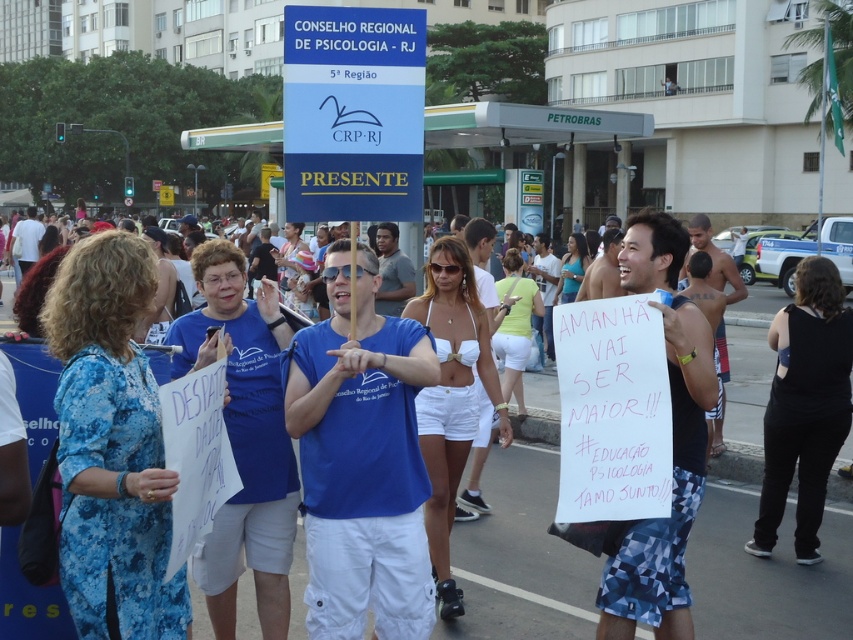
Question: Is white paper sign at center below blue plastic sign at upper center?

Choices:
 (A) yes
 (B) no

Answer: (A)

Question: Based on their relative distances, which object is nearer to the blue plastic sign at upper center?

Choices:
 (A) white paper sign at center
 (B) blue cotton shirt at center

Answer: (B)

Question: Which point appears closest to the camera in this image?

Choices:
 (A) (737, 614)
 (B) (337, 193)
 (C) (380, 634)

Answer: (B)

Question: Estimate the real-world distances between objects in this image. Which object is farther from the blue cotton shirt at center?

Choices:
 (A) blue plastic sign at upper center
 (B) white paper sign at center

Answer: (B)

Question: Does white paper sign at center come behind blue plastic sign at upper center?

Choices:
 (A) no
 (B) yes

Answer: (A)

Question: Is white paper sign at center positioned before blue cotton shirt at center?

Choices:
 (A) yes
 (B) no

Answer: (A)